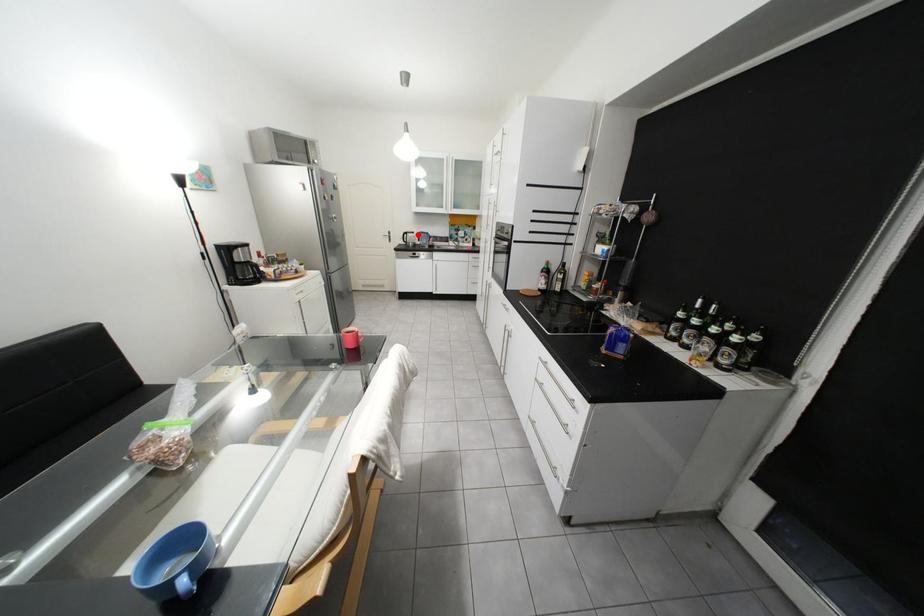
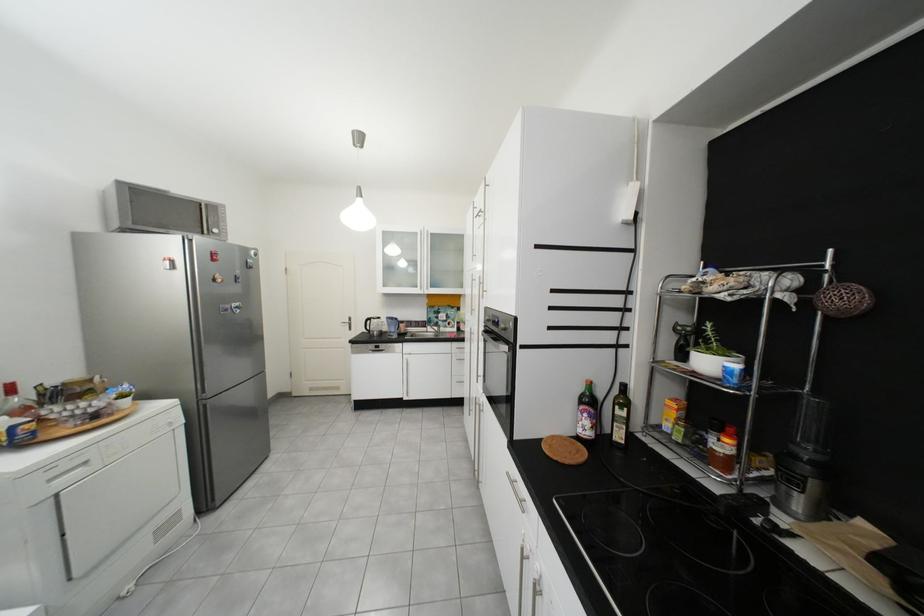
Where in the second image is the point corresponding to the highlighted location from the first image?

(381, 321)